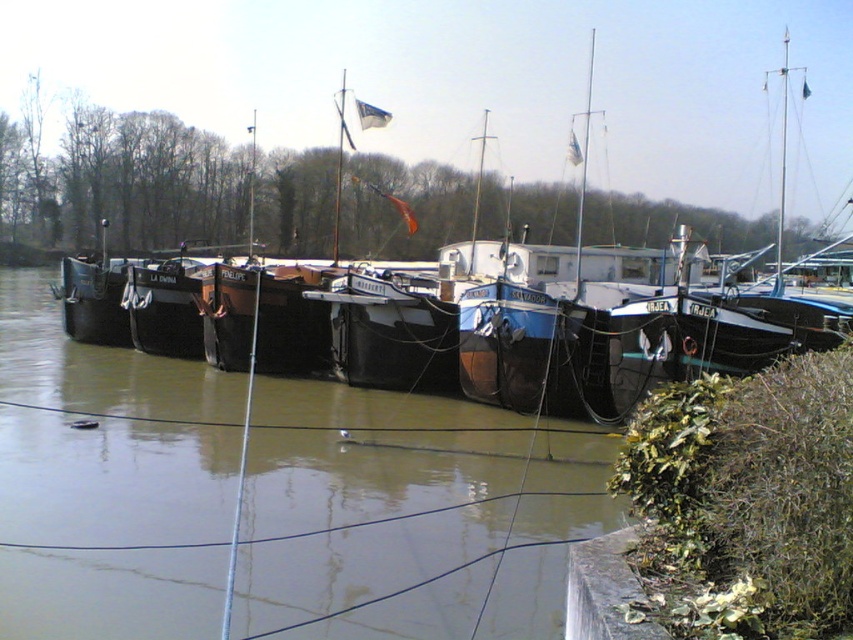
You are a tour guide leading a group along the riverside path. You need to inform your group about the distance between the brown matte water at center and the blue wooden boat at center. What do you tell them?

The distance between the brown matte water at center and the blue wooden boat at center is 23.48 meters.

You are standing on the riverside and want to take a photo of the two points marked on the barges. Which point, the point at coordinates (97, 397) or the point at coordinates (380, 224), will appear larger in your photo?

The point at coordinates (97, 397) will appear larger in the photo because it is closer to the camera than the point at coordinates (380, 224).